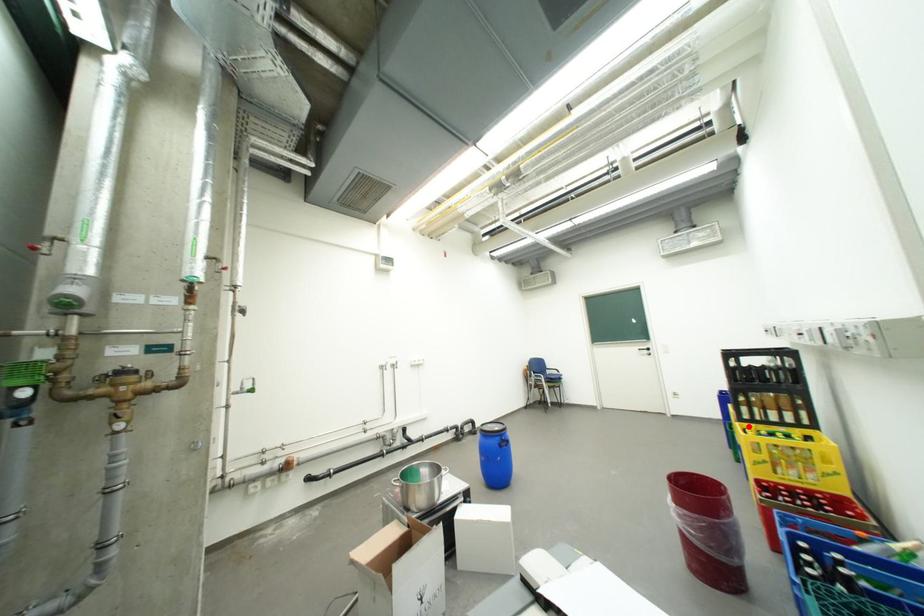
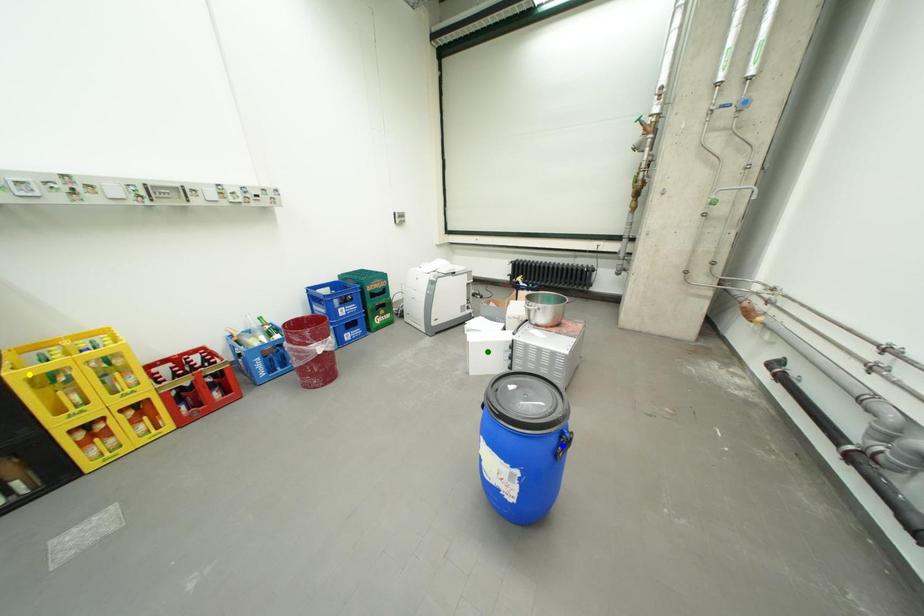
Question: I am providing you with two images of the same scene from different viewpoints. A red point is marked on the first image. You are given multiple points on the second image. Which mark in image 2 goes with the point in image 1?

Choices:
 (A) blue point
 (B) green point
 (C) yellow point

Answer: (C)